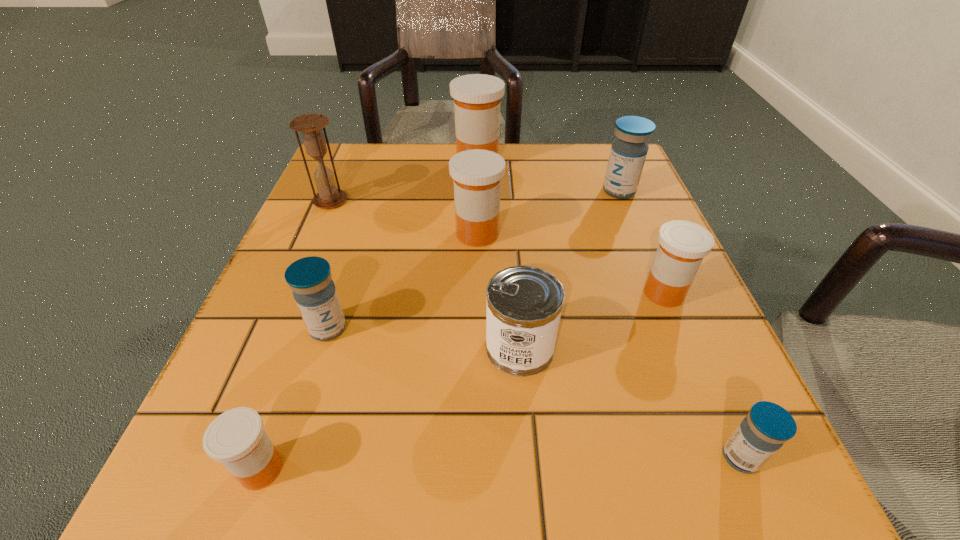
I want to click on the farthest orange medicine, so click(x=477, y=97).

Find the location of `the farthest object`. the farthest object is located at coordinates (477, 97).

At what (x,y) coordinates should I click in order to perform the action: click on hourglass. Please return your answer as a coordinate pair (x, y). This screenshot has width=960, height=540. Looking at the image, I should click on (310, 125).

Where is `the sixth nearest object`? Image resolution: width=960 pixels, height=540 pixels. the sixth nearest object is located at coordinates (476, 173).

The width and height of the screenshot is (960, 540). I want to click on the third nearest orange medicine, so click(476, 173).

Locate an element on the screen. the biggest blue medicine is located at coordinates (628, 152).

This screenshot has width=960, height=540. Find the location of `the farthest blue medicine`. the farthest blue medicine is located at coordinates (628, 152).

You are a GUI agent. You are given a task and a screenshot of the screen. Output one action in this format:
    pyautogui.click(x=<x>, y=<y>)
    Task: Click on the third biggest orange medicine
    The height and width of the screenshot is (540, 960).
    Given the screenshot: What is the action you would take?
    click(x=682, y=246)

Where is `the third farthest orange medicine`? the third farthest orange medicine is located at coordinates (682, 246).

Find the location of a particular element. This screenshot has height=540, width=960. the leftmost blue medicine is located at coordinates (315, 294).